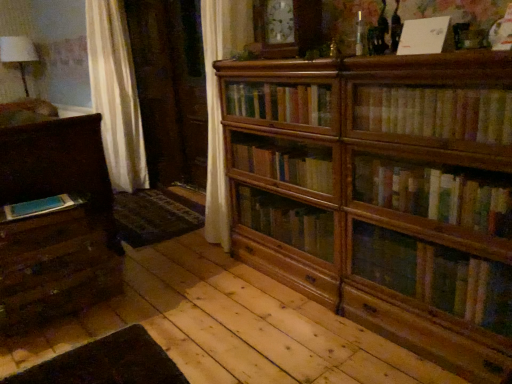
Question: Would you say wooden bookcase at center is inside or outside wooden drawer at lower left, which is the first drawer in bottom-to-top order?

Choices:
 (A) outside
 (B) inside

Answer: (A)

Question: In terms of size, does wooden bookcase at center appear bigger or smaller than wooden drawer at lower left, which is the first drawer in bottom-to-top order?

Choices:
 (A) big
 (B) small

Answer: (A)

Question: Which object is the closest to the wooden bookcase at center?

Choices:
 (A) blue matte book at lower left, which is the 3th book in front-to-back order
 (B) wooden drawer at lower left, arranged as the 2th drawer when viewed from the top
 (C) matte dark brown chest of drawers at left
 (D) yellowish paperbacks at upper right, the 1th book viewed from the right
 (E) wooden drawer at lower left, which is the first drawer in top-to-bottom order

Answer: (D)

Question: Estimate the real-world distances between objects in this image. Which object is farther from the white paper at upper center, the second book when ordered from left to right?

Choices:
 (A) wooden drawer at lower left, which is the first drawer in top-to-bottom order
 (B) wooden drawer at lower left, which is the first drawer in bottom-to-top order
 (C) blue matte book at lower left, positioned as the third book in right-to-left order
 (D) matte dark brown chest of drawers at left
 (E) yellowish paperbacks at upper right, the 2th book when ordered from bottom to top

Answer: (B)